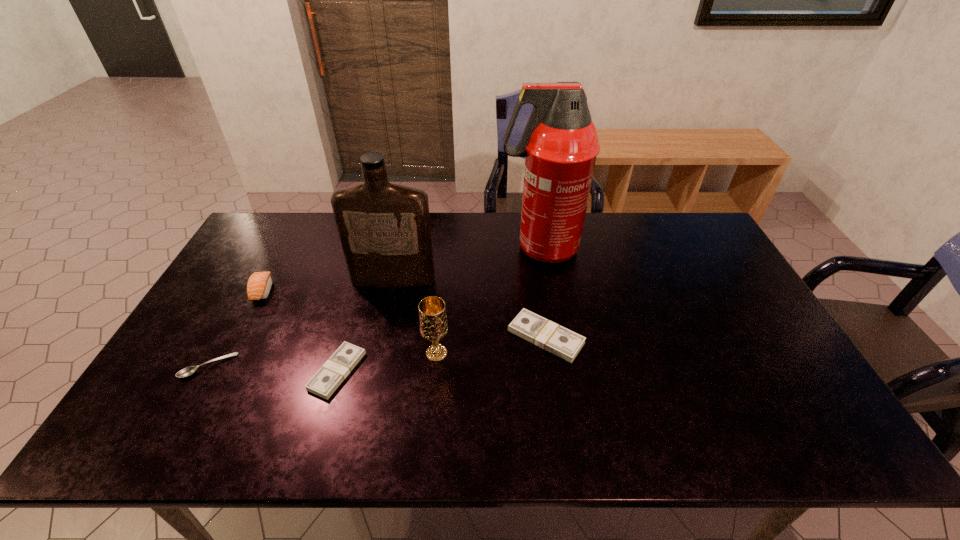
Find the location of a particular element. the sixth closest object relative to the fourth tallest object is located at coordinates (564, 343).

At what (x,y) coordinates should I click in order to perform the action: click on vacant space that satisfies the following two spatial constraints: 1. on the label side of the taller dollar; 2. on the right side of the liquor. Please return your answer as a coordinate pair (x, y). The width and height of the screenshot is (960, 540). Looking at the image, I should click on (381, 337).

Where is `vacant space that satisfies the following two spatial constraints: 1. on the label side of the liquor; 2. on the left side of the third tallest object`? vacant space that satisfies the following two spatial constraints: 1. on the label side of the liquor; 2. on the left side of the third tallest object is located at coordinates pos(378,354).

Identify the location of free spot that satisfies the following two spatial constraints: 1. on the label side of the third shortest object; 2. on the right side of the sixth shortest object. This screenshot has width=960, height=540. (381, 337).

Where is `free space in the image that satisfies the following two spatial constraints: 1. on the label side of the right dollar; 2. on the right side of the liquor`? The image size is (960, 540). free space in the image that satisfies the following two spatial constraints: 1. on the label side of the right dollar; 2. on the right side of the liquor is located at coordinates (381, 337).

Locate an element on the screen. free space that satisfies the following two spatial constraints: 1. on the trigger side of the tallest object; 2. on the front side of the second shortest object is located at coordinates click(560, 371).